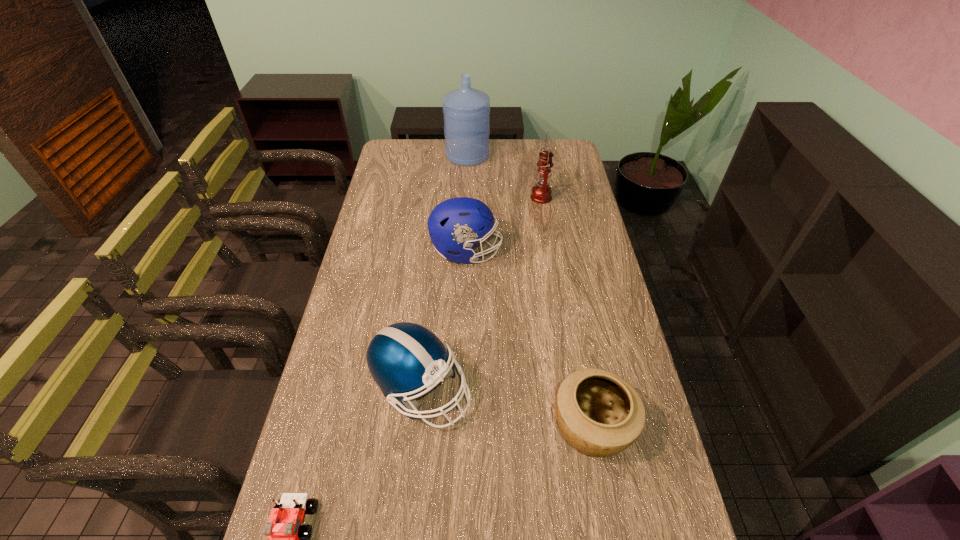
Find the location of a particular element. Image resolution: width=960 pixels, height=540 pixels. vacant space located 0.090m at the front of the nearer football helmet with the faceguard is located at coordinates (504, 390).

At what (x,y) coordinates should I click in order to perform the action: click on vacant position located 0.090m on the left of the second shortest object. Please return your answer as a coordinate pair (x, y). This screenshot has height=540, width=960. Looking at the image, I should click on (516, 428).

Where is `object that is at the far edge`? The image size is (960, 540). object that is at the far edge is located at coordinates (466, 111).

The image size is (960, 540). I want to click on object that is at the left edge, so click(404, 358).

You are a GUI agent. You are given a task and a screenshot of the screen. Output one action in this format:
    pyautogui.click(x=<x>, y=<y>)
    Task: Click on the oil lamp that is at the right edge
    
    Given the screenshot: What is the action you would take?
    pyautogui.click(x=541, y=193)

Locate an element on the screen. Image resolution: width=960 pixels, height=540 pixels. pottery located in the right edge section of the desktop is located at coordinates (600, 414).

This screenshot has height=540, width=960. Identify the location of vacant area at the far edge. (493, 158).

Find the location of `vacant region at the left edge of the desktop`. vacant region at the left edge of the desktop is located at coordinates (382, 196).

At what (x,y) coordinates should I click in order to perform the action: click on vacant region at the right edge of the desktop. Please return your answer as a coordinate pair (x, y). This screenshot has height=540, width=960. Looking at the image, I should click on (578, 170).

You are a GUI agent. You are given a task and a screenshot of the screen. Output one action in this format:
    pyautogui.click(x=<x>, y=<y>)
    Task: Click on the vacant point at the far left corner
    Image resolution: width=960 pixels, height=540 pixels.
    Given the screenshot: What is the action you would take?
    pyautogui.click(x=408, y=146)